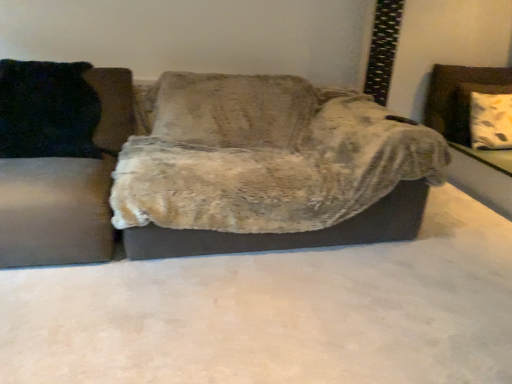
Question: Is velvet black pillow at left, which is the first studio couch from left to right, at the right side of white textured cushion at right?

Choices:
 (A) yes
 (B) no

Answer: (B)

Question: Can you confirm if velvet black pillow at left, which is the first studio couch from left to right, is shorter than white textured cushion at right?

Choices:
 (A) yes
 (B) no

Answer: (B)

Question: Is velvet black pillow at left, which is the first studio couch from left to right, behind white textured cushion at right?

Choices:
 (A) no
 (B) yes

Answer: (A)

Question: Is velvet black pillow at left, which is the second studio couch from right to left, positioned before white textured cushion at right?

Choices:
 (A) yes
 (B) no

Answer: (A)

Question: From a real-world perspective, is velvet black pillow at left, which is the first studio couch from left to right, under white textured cushion at right?

Choices:
 (A) yes
 (B) no

Answer: (A)

Question: Do you think fuzzy fabric couch at center, the 2th studio couch from the left, is within black fuzzy pillow at left, or outside of it?

Choices:
 (A) outside
 (B) inside

Answer: (A)

Question: Is fuzzy fabric couch at center, the 1th studio couch in the right-to-left sequence, wider or thinner than black fuzzy pillow at left?

Choices:
 (A) thin
 (B) wide

Answer: (B)

Question: From a real-world perspective, relative to black fuzzy pillow at left, is fuzzy fabric couch at center, the 2th studio couch from the left, vertically above or below?

Choices:
 (A) above
 (B) below

Answer: (B)

Question: From the image's perspective, is fuzzy fabric couch at center, the 2th studio couch from the left, positioned above or below black fuzzy pillow at left?

Choices:
 (A) below
 (B) above

Answer: (A)

Question: From a real-world perspective, is black fuzzy pillow at left physically located above or below fuzzy fabric couch at center, the 2th studio couch from the left?

Choices:
 (A) below
 (B) above

Answer: (B)

Question: From the image's perspective, is black fuzzy pillow at left positioned above or below fuzzy fabric couch at center, the 2th studio couch from the left?

Choices:
 (A) above
 (B) below

Answer: (A)

Question: Is black fuzzy pillow at left in front of or behind fuzzy fabric couch at center, the 1th studio couch in the right-to-left sequence, in the image?

Choices:
 (A) front
 (B) behind

Answer: (B)

Question: Does point (71, 129) appear closer or farther from the camera than point (271, 109)?

Choices:
 (A) farther
 (B) closer

Answer: (B)

Question: From the image's perspective, is black fuzzy pillow at left positioned above or below white textured cushion at right?

Choices:
 (A) above
 (B) below

Answer: (B)

Question: From a real-world perspective, is black fuzzy pillow at left positioned above or below white textured cushion at right?

Choices:
 (A) below
 (B) above

Answer: (B)